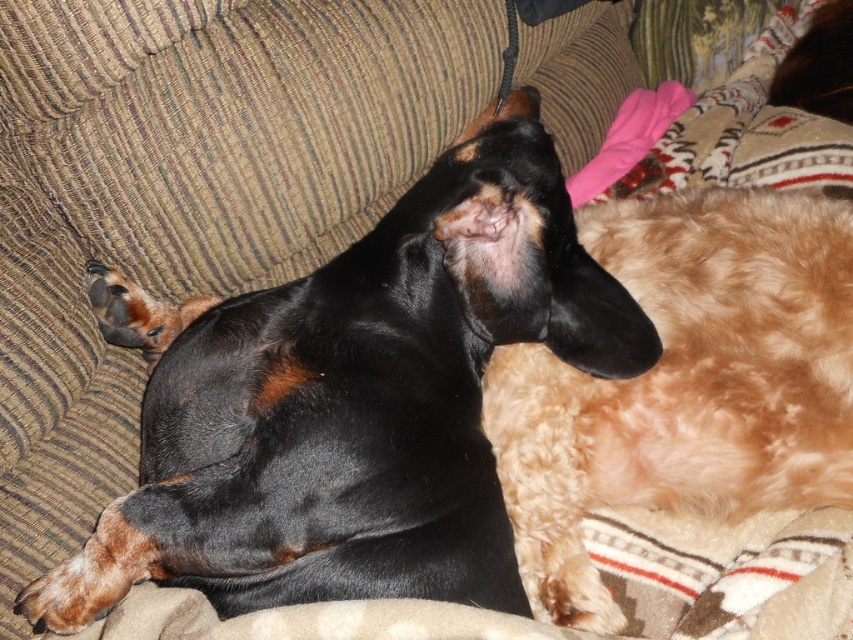
Question: Which of the following is the farthest from the observer?

Choices:
 (A) black smooth dog at center
 (B) fuzzy brown dog at upper right

Answer: (B)

Question: Which object appears closest to the camera in this image?

Choices:
 (A) black smooth dog at center
 (B) fuzzy brown dog at upper right

Answer: (A)

Question: Does black smooth dog at center appear over fuzzy brown dog at upper right?

Choices:
 (A) yes
 (B) no

Answer: (A)

Question: Does black smooth dog at center have a greater width compared to fuzzy brown dog at upper right?

Choices:
 (A) yes
 (B) no

Answer: (A)

Question: Which of the following is the closest to the observer?

Choices:
 (A) black smooth dog at center
 (B) fuzzy brown dog at upper right

Answer: (A)

Question: Is black smooth dog at center smaller than fuzzy brown dog at upper right?

Choices:
 (A) no
 (B) yes

Answer: (A)